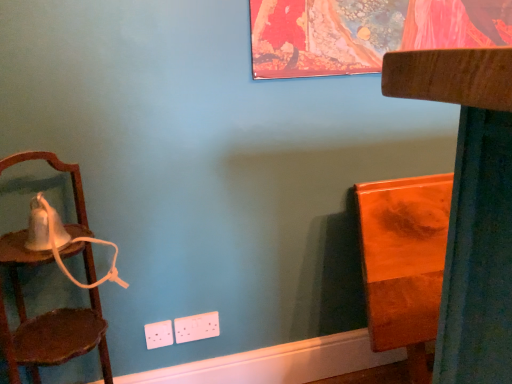
Where is `orange glossy wood at right, which is the 1th furniture in back-to-front order`? orange glossy wood at right, which is the 1th furniture in back-to-front order is located at coordinates (404, 262).

Based on their sizes in the image, would you say wooden chair at left is bigger or smaller than wooden chair at right, the 2th furniture viewed from the back?

wooden chair at left is smaller than wooden chair at right, the 2th furniture viewed from the back.

Based on the photo, between wooden chair at left and wooden chair at right, placed as the 1th furniture when sorted from front to back, which one has more height?

wooden chair at right, placed as the 1th furniture when sorted from front to back.

In the scene shown: Is wooden chair at left wider than orange glossy wood at right, which is the 1th furniture in back-to-front order?

Indeed, wooden chair at left has a greater width compared to orange glossy wood at right, which is the 1th furniture in back-to-front order.

In the scene shown: Can we say wooden chair at left lies outside orange glossy wood at right, which is the 1th furniture in back-to-front order?

wooden chair at left lies outside orange glossy wood at right, which is the 1th furniture in back-to-front order,'s area.

Which of these two, wooden chair at left or orange glossy wood at right, placed as the second furniture when sorted from front to back, stands shorter?

Standing shorter between the two is wooden chair at left.

Can we say wooden chair at right, the 2th furniture viewed from the back, lies outside orange glossy wood at right, which is the 1th furniture in back-to-front order?

No, wooden chair at right, the 2th furniture viewed from the back, is not outside of orange glossy wood at right, which is the 1th furniture in back-to-front order.

Considering the positions of objects wooden chair at right, placed as the 1th furniture when sorted from front to back, and orange glossy wood at right, placed as the second furniture when sorted from front to back, in the image provided, who is in front, wooden chair at right, placed as the 1th furniture when sorted from front to back, or orange glossy wood at right, placed as the second furniture when sorted from front to back,?

wooden chair at right, placed as the 1th furniture when sorted from front to back, is closer to the camera.

Identify the location of furniture above the wooden chair at right, placed as the 1th furniture when sorted from front to back (from the image's perspective). (404, 262).

Could you tell me if wooden chair at right, the 2th furniture viewed from the back, is facing orange glossy wood at right, placed as the second furniture when sorted from front to back?

Yes, wooden chair at right, the 2th furniture viewed from the back, is facing orange glossy wood at right, placed as the second furniture when sorted from front to back.

Does orange glossy wood at right, which is the 1th furniture in back-to-front order, lie behind wooden chair at left?

Yes, the depth of orange glossy wood at right, which is the 1th furniture in back-to-front order, is greater than that of wooden chair at left.

From the image's perspective, between orange glossy wood at right, which is the 1th furniture in back-to-front order, and wooden chair at left, which one is located above?

wooden chair at left.

In the scene shown: Considering the relative sizes of orange glossy wood at right, which is the 1th furniture in back-to-front order, and wooden chair at left in the image provided, is orange glossy wood at right, which is the 1th furniture in back-to-front order, thinner than wooden chair at left?

Correct, the width of orange glossy wood at right, which is the 1th furniture in back-to-front order, is less than that of wooden chair at left.

Where is `chair on the left of orange glossy wood at right, which is the 1th furniture in back-to-front order`? The width and height of the screenshot is (512, 384). chair on the left of orange glossy wood at right, which is the 1th furniture in back-to-front order is located at coordinates (47, 322).

Is orange glossy wood at right, which is the 1th furniture in back-to-front order, located outside wooden chair at right, the 2th furniture viewed from the back?

Actually, orange glossy wood at right, which is the 1th furniture in back-to-front order, is at least partially inside wooden chair at right, the 2th furniture viewed from the back.

Based on their positions, is orange glossy wood at right, which is the 1th furniture in back-to-front order, located to the left or right of wooden chair at right, the 2th furniture viewed from the back?

orange glossy wood at right, which is the 1th furniture in back-to-front order, is to the right of wooden chair at right, the 2th furniture viewed from the back.

From the image's perspective, relative to wooden chair at right, the 2th furniture viewed from the back, is orange glossy wood at right, which is the 1th furniture in back-to-front order, above or below?

From the image's perspective, orange glossy wood at right, which is the 1th furniture in back-to-front order, appears above wooden chair at right, the 2th furniture viewed from the back.

Is point (402, 236) positioned in front of point (478, 132)?

No, (402, 236) is further to viewer.

Would you say wooden chair at right, the 2th furniture viewed from the back, is inside or outside wooden chair at left?

wooden chair at right, the 2th furniture viewed from the back, exists outside the volume of wooden chair at left.

Does point (442, 301) come closer to viewer compared to point (13, 157)?

Yes, point (442, 301) is in front of point (13, 157).

Is wooden chair at right, the 2th furniture viewed from the back, taller than wooden chair at left?

Yes.

From a real-world perspective, is wooden chair at right, the 2th furniture viewed from the back, located higher than wooden chair at left?

Incorrect, from a real-world perspective, wooden chair at right, the 2th furniture viewed from the back, is lower than wooden chair at left.

Find the location of a particular element. Image resolution: width=512 pixels, height=384 pixels. chair that appears on the left of wooden chair at right, placed as the 1th furniture when sorted from front to back is located at coordinates (47, 322).

This screenshot has width=512, height=384. In order to click on furniture that is the 2nd one when counting rightward from the wooden chair at left in this screenshot , I will do `click(404, 262)`.

When comparing their distances from wooden chair at left, does orange glossy wood at right, which is the 1th furniture in back-to-front order, or wooden chair at right, the 2th furniture viewed from the back, seem closer?

orange glossy wood at right, which is the 1th furniture in back-to-front order, is closer to wooden chair at left.

Looking at the image, which one is located further to wooden chair at right, the 2th furniture viewed from the back, orange glossy wood at right, placed as the second furniture when sorted from front to back, or wooden chair at left?

wooden chair at left is further to wooden chair at right, the 2th furniture viewed from the back.

Considering their positions, is wooden chair at left positioned further to orange glossy wood at right, which is the 1th furniture in back-to-front order, than wooden chair at right, placed as the 1th furniture when sorted from front to back?

Among the two, wooden chair at left is located further to orange glossy wood at right, which is the 1th furniture in back-to-front order.

Considering their positions, is wooden chair at right, the 2th furniture viewed from the back, positioned further to wooden chair at left than orange glossy wood at right, placed as the second furniture when sorted from front to back?

The object further to wooden chair at left is wooden chair at right, the 2th furniture viewed from the back.

Estimate the real-world distances between objects in this image. Which object is closer to wooden chair at right, placed as the 1th furniture when sorted from front to back, wooden chair at left or orange glossy wood at right, placed as the second furniture when sorted from front to back?

orange glossy wood at right, placed as the second furniture when sorted from front to back, lies closer to wooden chair at right, placed as the 1th furniture when sorted from front to back, than the other object.

From the image, which object appears to be farther from orange glossy wood at right, placed as the second furniture when sorted from front to back, wooden chair at right, the 2th furniture viewed from the back, or wooden chair at left?

wooden chair at left.

The width and height of the screenshot is (512, 384). In order to click on furniture between wooden chair at left and orange glossy wood at right, placed as the second furniture when sorted from front to back, from left to right in this screenshot , I will do `click(471, 205)`.